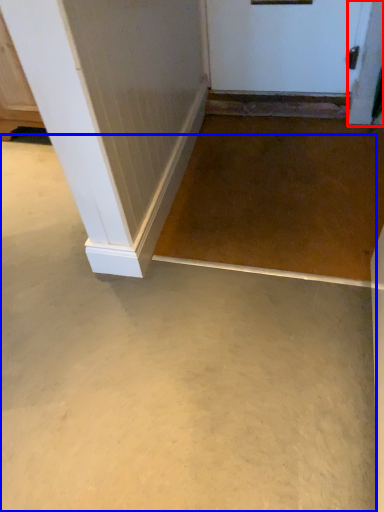
Question: Which point is further to the camera, screen door (highlighted by a red box) or concrete (highlighted by a blue box)?

Choices:
 (A) screen door
 (B) concrete

Answer: (A)